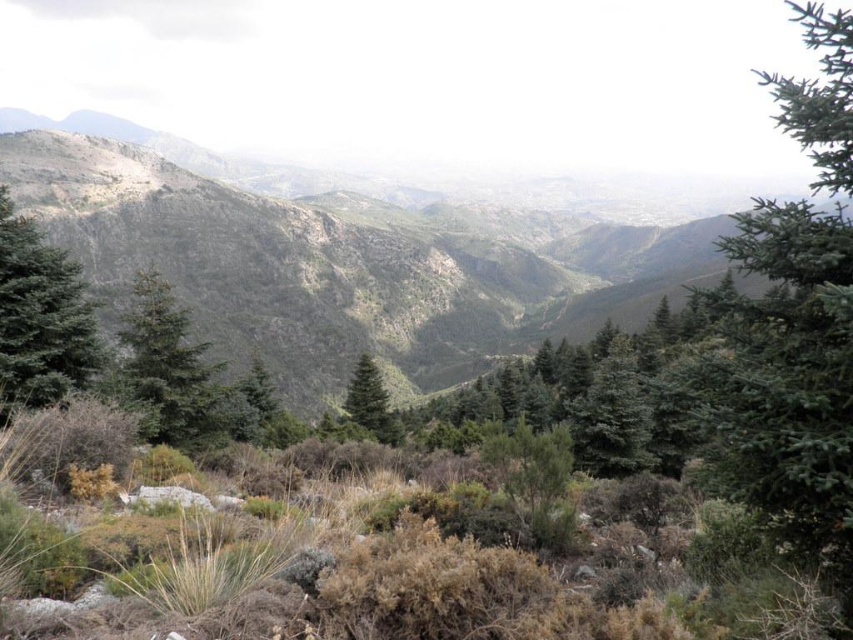
You are an environmental scientist assessing the elevation differences in this mountainous landscape. Given that the green textured mountain at center and the green matte tree at center are both visible from your current position, which object has a greater height?

The green textured mountain at center is taller than the green matte tree at center, making it the higher object in this landscape.